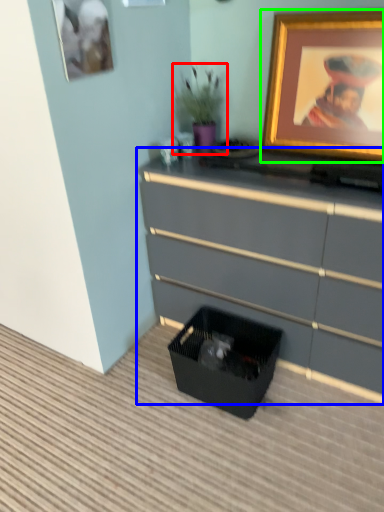
Question: Considering the real-world distances, which object is closest to houseplant (highlighted by a red box)? chest of drawers (highlighted by a blue box) or picture frame (highlighted by a green box).

Choices:
 (A) chest of drawers
 (B) picture frame

Answer: (B)